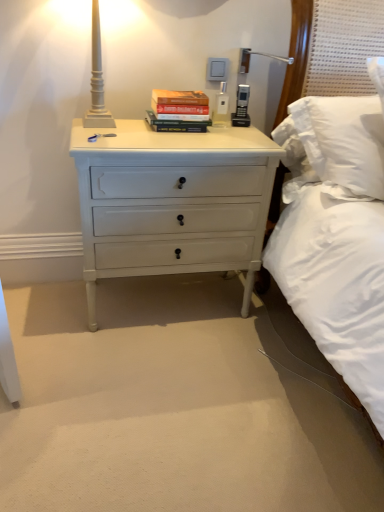
What do you see at coordinates (97, 79) in the screenshot?
I see `white matte lamp at upper left` at bounding box center [97, 79].

This screenshot has height=512, width=384. I want to click on white painted wood chest of drawers at center, so click(172, 202).

How distant is hardcover book at center from white matte lamp at upper left?

hardcover book at center and white matte lamp at upper left are 9.57 inches apart.

Relative to white matte lamp at upper left, is hardcover book at center in front or behind?

In the image, hardcover book at center appears behind white matte lamp at upper left.

Can you confirm if hardcover book at center is smaller than white matte lamp at upper left?

Correct, hardcover book at center occupies less space than white matte lamp at upper left.

Is hardcover book at center positioned with its back to white matte lamp at upper left?

hardcover book at center is not turned away from white matte lamp at upper left.

Is white matte lamp at upper left smaller than hardcover book at center?

No, white matte lamp at upper left is not smaller than hardcover book at center.

Consider the image. Is white matte lamp at upper left far away from hardcover book at center?

No, white matte lamp at upper left is in close proximity to hardcover book at center.

Could hardcover book at center be considered to be inside white matte lamp at upper left?

Actually, hardcover book at center is outside white matte lamp at upper left.

Where is `paperback book behind the white matte lamp at upper left`? Image resolution: width=384 pixels, height=512 pixels. paperback book behind the white matte lamp at upper left is located at coordinates (179, 111).

From the picture: Is the surface of white painted wood chest of drawers at center in direct contact with hardcover book at center?

No, white painted wood chest of drawers at center is not beside hardcover book at center.

Is white painted wood chest of drawers at center spatially inside hardcover book at center, or outside of it?

white painted wood chest of drawers at center is not enclosed by hardcover book at center.

From the image's perspective, is white painted wood chest of drawers at center positioned above or below hardcover book at center?

Clearly, from the image's perspective, white painted wood chest of drawers at center is below hardcover book at center.

Looking at this image, is white painted wood chest of drawers at center facing away from hardcover book at center?

No, white painted wood chest of drawers at center is not facing away from hardcover book at center.

Is white painted wood chest of drawers at center closer to camera compared to white matte lamp at upper left?

No, it is not.

From a real-world perspective, is white painted wood chest of drawers at center positioned over white matte lamp at upper left based on gravity?

No.

From the image's perspective, who appears lower, white painted wood chest of drawers at center or white matte lamp at upper left?

From the image's view, white painted wood chest of drawers at center is below.

Where is `chest of drawers behind the white matte lamp at upper left`? This screenshot has height=512, width=384. chest of drawers behind the white matte lamp at upper left is located at coordinates [172, 202].

Consider the image. Between white matte lamp at upper left and white painted wood chest of drawers at center, which one appears on the right side from the viewer's perspective?

Positioned to the right is white painted wood chest of drawers at center.

Are white matte lamp at upper left and white painted wood chest of drawers at center far apart?

white matte lamp at upper left is actually quite close to white painted wood chest of drawers at center.

Choose the correct answer: Is white matte lamp at upper left inside white painted wood chest of drawers at center or outside it?

white matte lamp at upper left lies outside white painted wood chest of drawers at center.

Consider the image. How different are the orientations of white matte lamp at upper left and white painted wood chest of drawers at center in degrees?

They differ by 0.567 degrees in their facing directions.

Which object is more forward, hardcover book at center or white painted wood chest of drawers at center?

white painted wood chest of drawers at center is more forward.

Considering the points (174, 105) and (131, 251), which point is behind, point (174, 105) or point (131, 251)?

The point (131, 251) is farther from the camera.

Is hardcover book at center located outside white painted wood chest of drawers at center?

Indeed, hardcover book at center is completely outside white painted wood chest of drawers at center.

Which is more to the left, hardcover book at center or white painted wood chest of drawers at center?

From the viewer's perspective, white painted wood chest of drawers at center appears more on the left side.

In order to click on paperback book lying below the white matte lamp at upper left (from the image's perspective) in this screenshot , I will do `click(179, 111)`.

In order to click on bedside lamp above the hardcover book at center (from the image's perspective) in this screenshot , I will do `click(97, 79)`.

Looking at the image, which one is located closer to white matte lamp at upper left, white painted wood chest of drawers at center or hardcover book at center?

hardcover book at center is positioned closer to the anchor white matte lamp at upper left.

Looking at the image, which one is located further to white matte lamp at upper left, hardcover book at center or white painted wood chest of drawers at center?

white painted wood chest of drawers at center.

Estimate the real-world distances between objects in this image. Which object is closer to white painted wood chest of drawers at center, hardcover book at center or white matte lamp at upper left?

Based on the image, hardcover book at center appears to be nearer to white painted wood chest of drawers at center.

Based on their spatial positions, is white matte lamp at upper left or hardcover book at center further from white painted wood chest of drawers at center?

white matte lamp at upper left lies further to white painted wood chest of drawers at center than the other object.

Considering their positions, is white matte lamp at upper left positioned further to hardcover book at center than white painted wood chest of drawers at center?

white painted wood chest of drawers at center is further to hardcover book at center.

Looking at the image, which one is located closer to hardcover book at center, white painted wood chest of drawers at center or white matte lamp at upper left?

white matte lamp at upper left lies closer to hardcover book at center than the other object.

The height and width of the screenshot is (512, 384). Find the location of `paperback book between white matte lamp at upper left and white painted wood chest of drawers at center vertically`. paperback book between white matte lamp at upper left and white painted wood chest of drawers at center vertically is located at coordinates (179, 111).